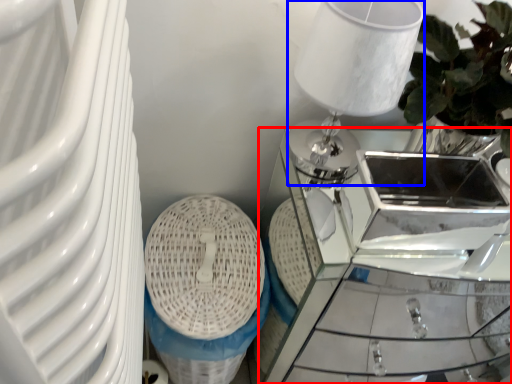
Question: Which object appears farthest to the camera in this image, table (highlighted by a red box) or table lamp (highlighted by a blue box)?

Choices:
 (A) table
 (B) table lamp

Answer: (A)